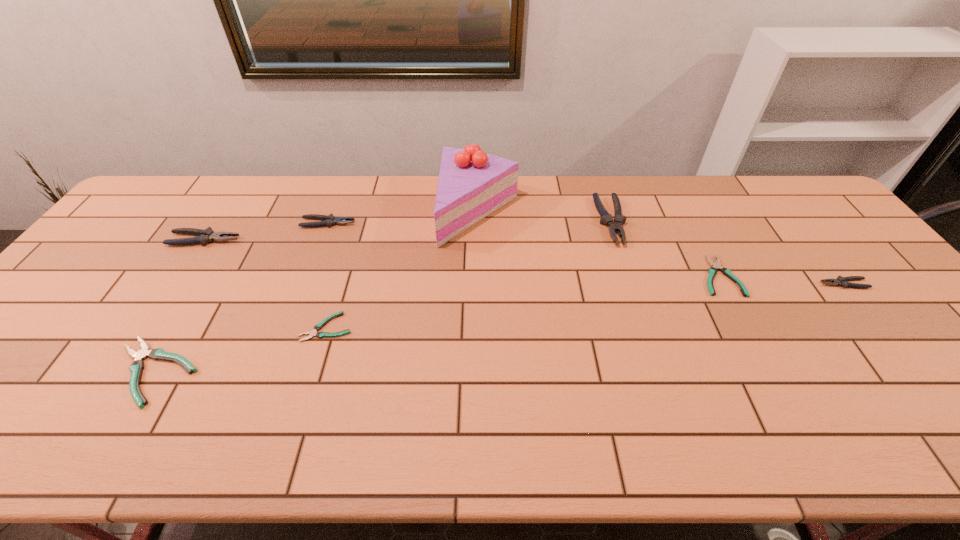
Image resolution: width=960 pixels, height=540 pixels. I want to click on cake, so click(472, 184).

Image resolution: width=960 pixels, height=540 pixels. Find the location of `the tallest object`. the tallest object is located at coordinates (472, 184).

In order to click on the sixth object from left to right in this screenshot , I will do (606, 218).

Locate an element on the screen. The image size is (960, 540). the third pliers from right to left is located at coordinates (606, 218).

Where is `the second tallest pliers`? Image resolution: width=960 pixels, height=540 pixels. the second tallest pliers is located at coordinates (205, 236).

Locate an element on the screen. This screenshot has height=540, width=960. the leftmost gray pliers is located at coordinates (205, 236).

I want to click on the third gray pliers from right to left, so [329, 220].

I want to click on the fourth tallest object, so click(329, 220).

Where is `the rightmost gray pliers`? The image size is (960, 540). the rightmost gray pliers is located at coordinates (842, 281).

The image size is (960, 540). I want to click on the rightmost object, so click(842, 281).